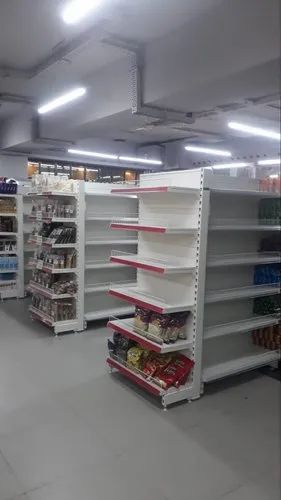
Image resolution: width=281 pixels, height=500 pixels. What are the coordinates of `stocked shelves` in the screenshot? It's located at (39, 314), (38, 190), (39, 285), (41, 261), (40, 236), (38, 212).